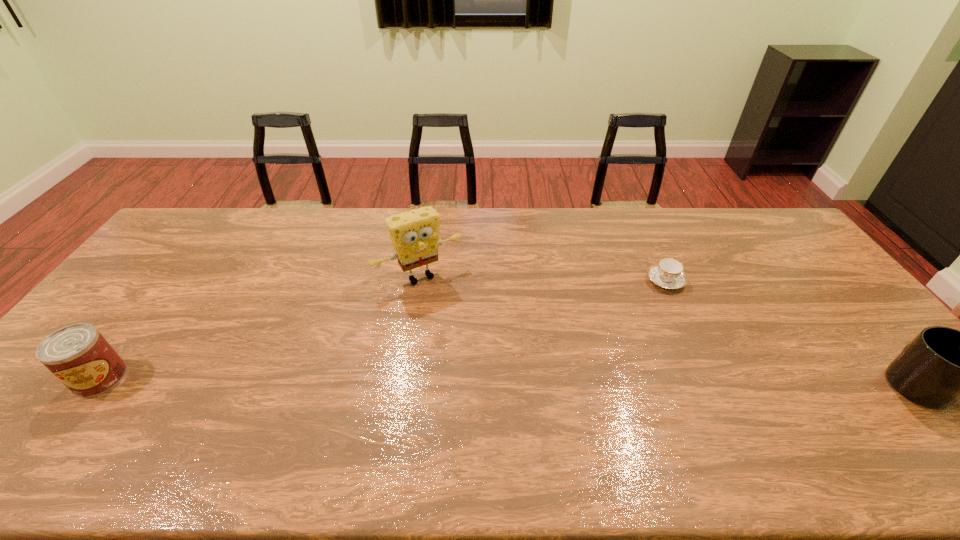
Find the location of `can`. can is located at coordinates (78, 355).

Find the location of `teacup`. teacup is located at coordinates (668, 273).

You are a GUI agent. You are given a task and a screenshot of the screen. Output one action in this format:
    pyautogui.click(x=<x>, y=<y>)
    Task: Click on the third object from left to right
    
    Given the screenshot: What is the action you would take?
    pyautogui.click(x=668, y=273)

Image resolution: width=960 pixels, height=540 pixels. I want to click on the third object from right to left, so click(415, 234).

Where is `the tallest object`? Image resolution: width=960 pixels, height=540 pixels. the tallest object is located at coordinates (415, 234).

Locate an element on the screen. The image size is (960, 540). vacant space located 0.060m on the right of the leftmost object is located at coordinates (147, 378).

You are a GUI agent. You are given a task and a screenshot of the screen. Output one action in this format:
    pyautogui.click(x=<x>, y=<y>)
    Task: Click on the free space located on the side with the handle of the teacup
    This screenshot has height=540, width=960.
    Given the screenshot: What is the action you would take?
    pyautogui.click(x=642, y=300)

The width and height of the screenshot is (960, 540). What are the coordinates of `free location located 0.220m on the side with the handle of the teacup` in the screenshot? It's located at (612, 325).

You are a GUI agent. You are given a task and a screenshot of the screen. Output one action in this format:
    pyautogui.click(x=<x>, y=<y>)
    Task: Click on the vacant area located 0.090m on the side with the handle of the teacup
    
    Given the screenshot: What is the action you would take?
    pyautogui.click(x=638, y=303)

Find the location of `vacant point located 0.110m on the face of the sponge`. vacant point located 0.110m on the face of the sponge is located at coordinates (454, 314).